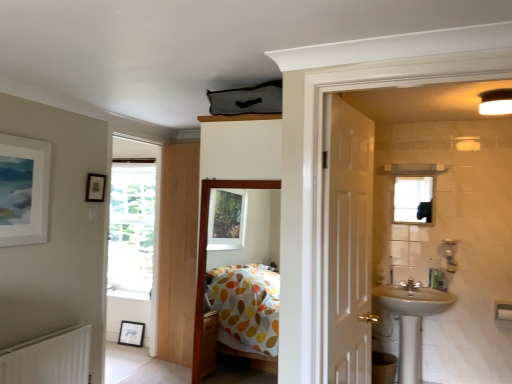
Find the location of `white matte light fixture at upper right`. white matte light fixture at upper right is located at coordinates point(496,102).

This screenshot has width=512, height=384. What do you see at coordinates (132, 227) in the screenshot? I see `transparent glass window at left` at bounding box center [132, 227].

This screenshot has height=384, width=512. What do you see at coordinates (95, 188) in the screenshot? I see `matte black picture frame at upper left, the first picture frame when ordered from top to bottom` at bounding box center [95, 188].

This screenshot has height=384, width=512. What do you see at coordinates (49, 358) in the screenshot? I see `white matte radiator at lower left` at bounding box center [49, 358].

The image size is (512, 384). Describe the element at coordinates (131, 333) in the screenshot. I see `black matte picture frame at lower left, positioned as the 1th picture frame in bottom-to-top order` at that location.

This screenshot has width=512, height=384. Identify the location of white ceramic sink at lower right. (408, 322).

Find the location of a particular element. white matte light fixture at upper right is located at coordinates (496, 102).

From a real-world perspective, is matte white picture frame at upper left, positioned as the 2th picture frame in top-to-bottom order, above or below clear glass mirror at upper right?

Clearly, from a real-world perspective, matte white picture frame at upper left, positioned as the 2th picture frame in top-to-bottom order, is below clear glass mirror at upper right.

How different are the orientations of matte white picture frame at upper left, positioned as the 2th picture frame in top-to-bottom order, and clear glass mirror at upper right in degrees?

90.9 degrees.

Which object is thinner, matte white picture frame at upper left, arranged as the 3th picture frame when viewed from the back, or clear glass mirror at upper right?

Thinner between the two is clear glass mirror at upper right.

Who is taller, transparent glass window at left or black matte picture frame at lower left, marked as the 3th picture frame in a front-to-back arrangement?

transparent glass window at left.

Which point is more distant from viewer, (x=115, y=271) or (x=135, y=338)?

The point (x=115, y=271) is behind.

Is transparent glass window at left positioned far away from black matte picture frame at lower left, positioned as the 1th picture frame in bottom-to-top order?

Yes, transparent glass window at left and black matte picture frame at lower left, positioned as the 1th picture frame in bottom-to-top order, are located far from each other.

Is transparent glass window at left in front of or behind black matte picture frame at lower left, which is the first picture frame in back-to-front order, in the image?

In the image, transparent glass window at left appears behind black matte picture frame at lower left, which is the first picture frame in back-to-front order.

Is white ceramic sink at lower right not within matte white picture frame at upper left, the 1th picture frame positioned from the front?

Yes, white ceramic sink at lower right is outside of matte white picture frame at upper left, the 1th picture frame positioned from the front.

Is white ceramic sink at lower right directly adjacent to matte white picture frame at upper left, which appears as the 2th picture frame when ordered from the bottom?

They are not placed beside each other.

Does point (398, 297) come in front of point (42, 185)?

No, (398, 297) is further to viewer.

Is white ceramic sink at lower right oriented away from matte white picture frame at upper left, positioned as the 2th picture frame in top-to-bottom order?

No, white ceramic sink at lower right is not facing the opposite direction of matte white picture frame at upper left, positioned as the 2th picture frame in top-to-bottom order.

Does black matte picture frame at lower left, positioned as the 1th picture frame in bottom-to-top order, have a lesser width compared to white matte radiator at lower left?

Yes, black matte picture frame at lower left, positioned as the 1th picture frame in bottom-to-top order, is thinner than white matte radiator at lower left.

Which object is more forward, black matte picture frame at lower left, which is the first picture frame in back-to-front order, or white matte radiator at lower left?

white matte radiator at lower left is in front.

Is point (137, 342) farther from viewer compared to point (24, 360)?

Yes, point (137, 342) is behind point (24, 360).

Between black matte picture frame at lower left, the third picture frame positioned from the top, and white matte radiator at lower left, which one appears on the left side from the viewer's perspective?

white matte radiator at lower left is more to the left.

Is black matte picture frame at lower left, positioned as the 1th picture frame in bottom-to-top order, shorter than matte black picture frame at upper left, the 2th picture frame viewed from the front?

In fact, black matte picture frame at lower left, positioned as the 1th picture frame in bottom-to-top order, may be taller than matte black picture frame at upper left, the 2th picture frame viewed from the front.

Between black matte picture frame at lower left, the third picture frame positioned from the top, and matte black picture frame at upper left, which is the third picture frame in bottom-to-top order, which one appears on the left side from the viewer's perspective?

From the viewer's perspective, black matte picture frame at lower left, the third picture frame positioned from the top, appears more on the left side.

Can you tell me how much black matte picture frame at lower left, which is the first picture frame in back-to-front order, and matte black picture frame at upper left, the 2th picture frame viewed from the front, differ in facing direction?

They differ by 89 degrees in their facing directions.

Between transparent glass window at left and white matte light fixture at upper right, which one has smaller width?

With smaller width is white matte light fixture at upper right.

Between transparent glass window at left and white matte light fixture at upper right, which one appears on the left side from the viewer's perspective?

From the viewer's perspective, transparent glass window at left appears more on the left side.

Can you confirm if transparent glass window at left is smaller than white matte light fixture at upper right?

No.

Looking at their sizes, would you say white matte door at center is wider or thinner than black matte picture frame at lower left, which is the first picture frame in back-to-front order?

In the image, white matte door at center appears to be more narrow than black matte picture frame at lower left, which is the first picture frame in back-to-front order.

Is black matte picture frame at lower left, the third picture frame positioned from the top, a part of white matte door at center?

Actually, black matte picture frame at lower left, the third picture frame positioned from the top, is outside white matte door at center.

In the scene shown: From a real-world perspective, who is located higher, white matte door at center or black matte picture frame at lower left, the third picture frame positioned from the top?

white matte door at center, from a real-world perspective.

Is white matte door at center bigger than black matte picture frame at lower left, which is the first picture frame in back-to-front order?

Yes.

Locate an element on the screen. This screenshot has width=512, height=384. the 2nd picture frame in front when counting from the clear glass mirror at upper right is located at coordinates (24, 190).

Where is `window on the left of black matte picture frame at lower left, the third picture frame positioned from the top`? The width and height of the screenshot is (512, 384). window on the left of black matte picture frame at lower left, the third picture frame positioned from the top is located at coordinates (132, 227).

In the scene shown: Which object lies further to the anchor point transparent glass window at left, white ceramic sink at lower right or black matte picture frame at lower left, positioned as the 1th picture frame in bottom-to-top order?

white ceramic sink at lower right lies further to transparent glass window at left than the other object.

Looking at this image, considering their positions, is white matte light fixture at upper right positioned closer to polka dot fabric bed at center than white ceramic sink at lower right?

white ceramic sink at lower right lies closer to polka dot fabric bed at center than the other object.

When comparing their distances from white matte radiator at lower left, does silver metallic tap at right or white ceramic sink at lower right seem further?

The object further to white matte radiator at lower left is silver metallic tap at right.

Looking at the image, which one is located closer to polka dot fabric bed at center, white matte radiator at lower left or white ceramic sink at lower right?

white matte radiator at lower left is positioned closer to the anchor polka dot fabric bed at center.

Which object lies further to the anchor point polka dot fabric bed at center, matte black picture frame at upper left, the first picture frame when ordered from top to bottom, or black matte picture frame at lower left, marked as the 3th picture frame in a front-to-back arrangement?

The object further to polka dot fabric bed at center is black matte picture frame at lower left, marked as the 3th picture frame in a front-to-back arrangement.

From the image, which object appears to be farther from black matte picture frame at lower left, the third picture frame positioned from the top, polka dot fabric bed at center or white matte door at center?

Among the two, white matte door at center is located further to black matte picture frame at lower left, the third picture frame positioned from the top.

Which object lies further to the anchor point white matte light fixture at upper right, white matte door at center or white matte radiator at lower left?

white matte radiator at lower left is further to white matte light fixture at upper right.

Looking at the image, which one is located further to matte black picture frame at upper left, which is the third picture frame in bottom-to-top order, transparent glass window at left or clear glass mirror at upper right?

Based on the image, clear glass mirror at upper right appears to be further to matte black picture frame at upper left, which is the third picture frame in bottom-to-top order.

The height and width of the screenshot is (384, 512). What are the coordinates of `radiator located between matte white picture frame at upper left, which appears as the 2th picture frame when ordered from the bottom, and white ceramic sink at lower right in the left-right direction` in the screenshot? It's located at (49, 358).

The height and width of the screenshot is (384, 512). I want to click on corridor positioned between white matte door at center and silver metallic tap at right from near to far, so click(206, 253).

I want to click on mirror between white matte door at center and transparent glass window at left along the z-axis, so click(413, 200).

The height and width of the screenshot is (384, 512). Identify the location of tap between white matte radiator at lower left and white matte light fixture at upper right in the horizontal direction. (410, 285).